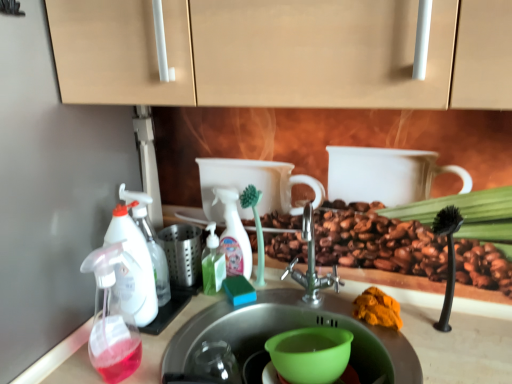
Identify the location of vacant space in front of translucent plastic spray bottle at center. This screenshot has width=512, height=384. [216, 314].